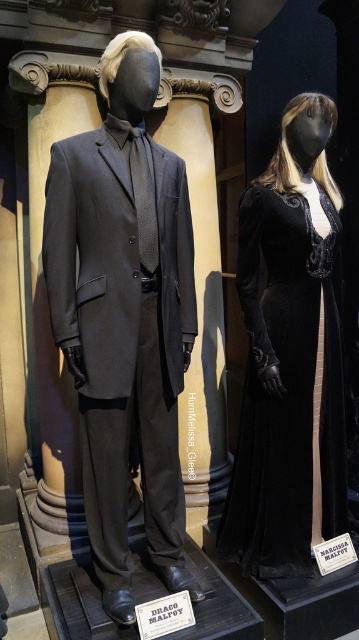
In the scene shown: You are a security guard in the museum and need to check the distance between the matte black suit at center and the nearest exit, which is located at point 0.5, 0.5. Can you determine if the distance is less than 0.1 units?

The matte black suit at center is located at point (124, 316). The nearest exit is at (179, 320). Calculating the distance between these points using the Euclidean formula, the distance is sqrt of squared differences in x and y coordinates. The difference in x is 0.006, squared is 0.000036. The difference in y is 0.152, squared is 0.023104. Summing these gives 0.02314, square root is approximately 0.152. Since 0.152 is greater than 0.1, the distance is not less than 0.1 units.

From the picture: You are a photographer standing 1.5 meters away from the camera. You want to take a photo of the matte black suit at center. Can you reach the camera to adjust it?

The distance between you and the camera is 1.5 meters, and the camera and the matte black suit at center are 1.72 meters apart. Therefore, the total distance between you and the matte black suit at center is 1.5m plus 1.72m equals 3.22 meters. Since you can only reach up to 1.5 meters, you cannot adjust the camera to focus on the matte black suit at center.

You are a fashion designer trying to fit a new dress into a display case. The display case can only accommodate items narrower than the velvet black dress at right. Can the matte black suit at center fit in the display case?

The matte black suit at center is narrower than the velvet black dress at right, so it can fit in the display case designed for items narrower than the dress.